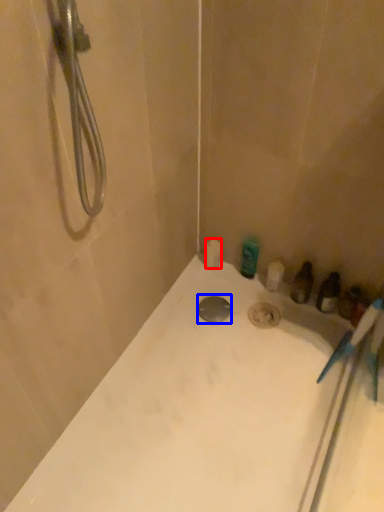
Question: Which object is further to the camera taking this photo, toilet paper (highlighted by a red box) or drain (highlighted by a blue box)?

Choices:
 (A) toilet paper
 (B) drain

Answer: (A)